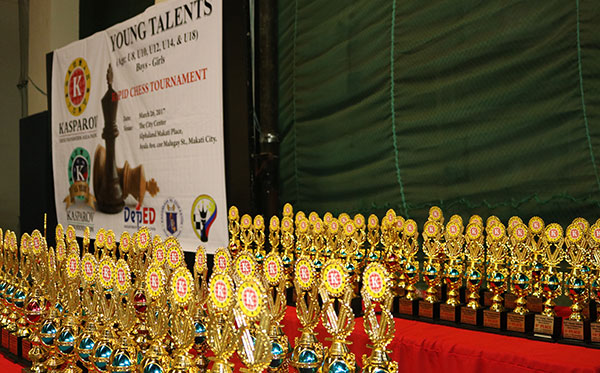
The image size is (600, 373). Identify the location of turquoise vertical stitching on black curtain. (396, 158).